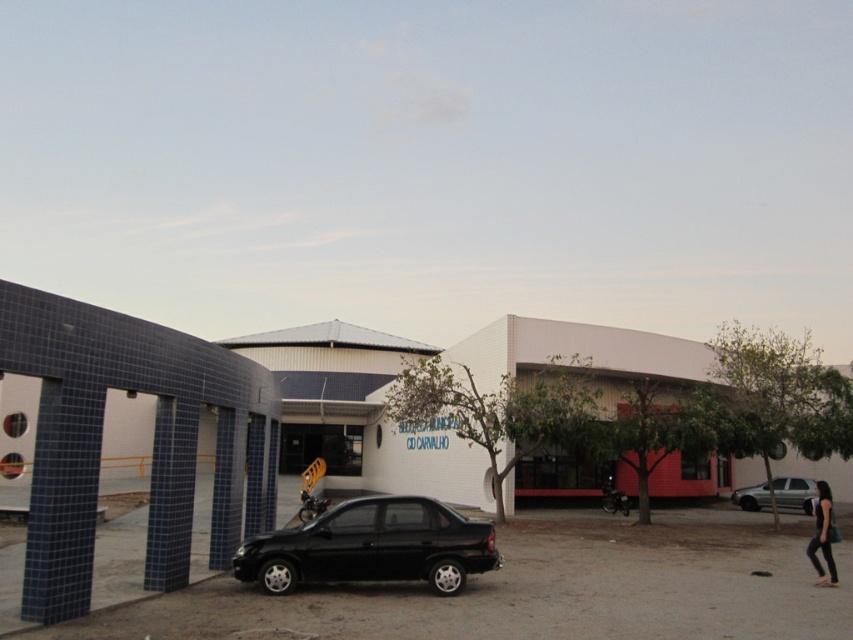
Consider the image. Can you confirm if black matte sedan at center is positioned to the left of silver metallic car at lower right?

Correct, you'll find black matte sedan at center to the left of silver metallic car at lower right.

Is point (351, 557) in front of point (773, 480)?

Yes, point (351, 557) is closer to viewer.

Does point (393, 500) come farther from viewer compared to point (732, 499)?

No, (393, 500) is in front of (732, 499).

Identify the location of black matte sedan at center. This screenshot has width=853, height=640. (372, 547).

Is point (241, 577) positioned after point (830, 557)?

That is False.

Between black matte sedan at center and black fabric at lower right, which one has less height?

black matte sedan at center

Who is more distant from viewer, (344,502) or (820,513)?

The point (820,513) is behind.

Locate an element on the screen. Image resolution: width=853 pixels, height=640 pixels. black matte sedan at center is located at coordinates (372, 547).

Does silver metallic car at lower right come in front of black fabric at lower right?

No, silver metallic car at lower right is behind black fabric at lower right.

Does point (795, 499) come farther from viewer compared to point (822, 552)?

That is True.

The height and width of the screenshot is (640, 853). Find the location of `silver metallic car at lower right`. silver metallic car at lower right is located at coordinates (793, 493).

Find the location of a particular element. silver metallic car at lower right is located at coordinates (793, 493).